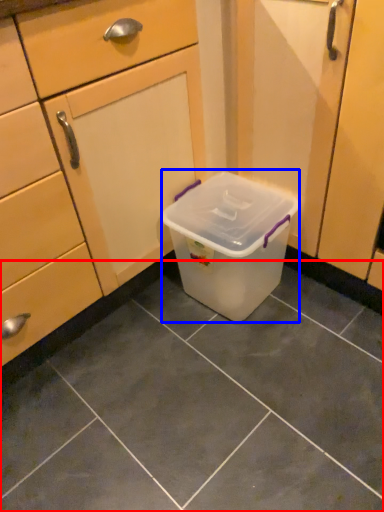
Question: Which object is further to the camera taking this photo, tile (highlighted by a red box) or storage box (highlighted by a blue box)?

Choices:
 (A) tile
 (B) storage box

Answer: (B)